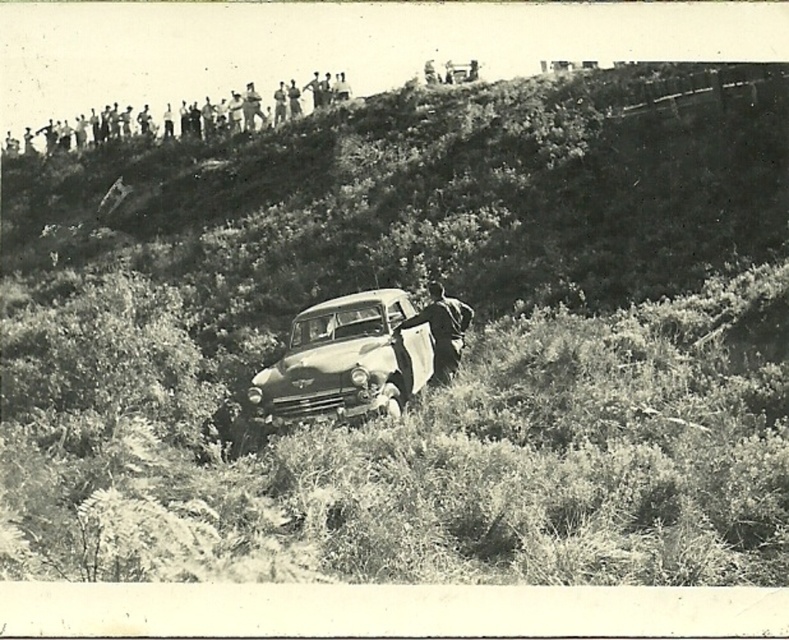
You are a photographer standing at the bottom of a steep hill. You want to take a photo of the shiny silver sedan at center. Given that the camera you are using has a maximum focus range of 12 meters, will you be able to capture the sedan clearly?

The shiny silver sedan at center is 12.37 meters away from the camera. Since the maximum focus range is 12 meters, the sedan is slightly out of range and may not be captured clearly.

You are a photographer trying to capture the shiny silver sedan at center in this black and white photo. The scene also includes a person in dark clothing standing near the car. Where exactly is the point with coordinates point (346, 362) located in relation to the shiny silver sedan at center?

The point (346, 362) is located on the shiny silver sedan at center.

You are a photographer trying to capture both the shiny silver sedan at center and the metallic silver pickup truck at center in a single frame. Based on their positions, which one is closer to the camera?

The shiny silver sedan at center is in front of the metallic silver pickup truck at center, so it is closer to the camera.